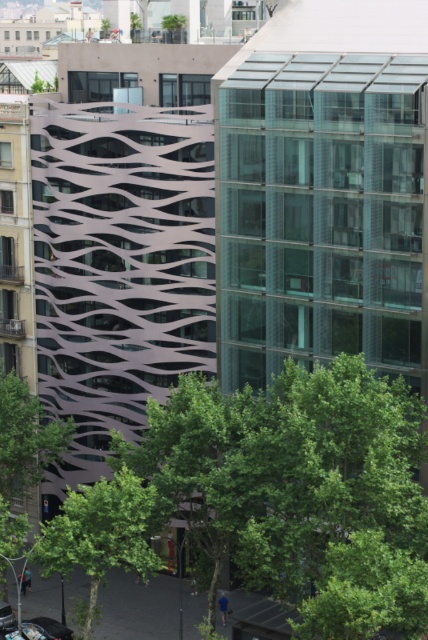
You are standing in the urban landscape shown. There is a point at coordinates (297, 484). Which object from the list contains this point? The objects are the white wavy line building on the left and the green leafy tree at center.

The point at coordinates (297, 484) is located on the green leafy tree at center.

You are standing in the urban landscape and want to take a photo of both the green leafy tree at center and the green leafy tree at lower center. Which tree should you position yourself to the left of to capture both in the frame?

You should position yourself to the left of the green leafy tree at lower center because the green leafy tree at center is to the right of it, so positioning yourself left of the lower center tree allows both to be in the frame.